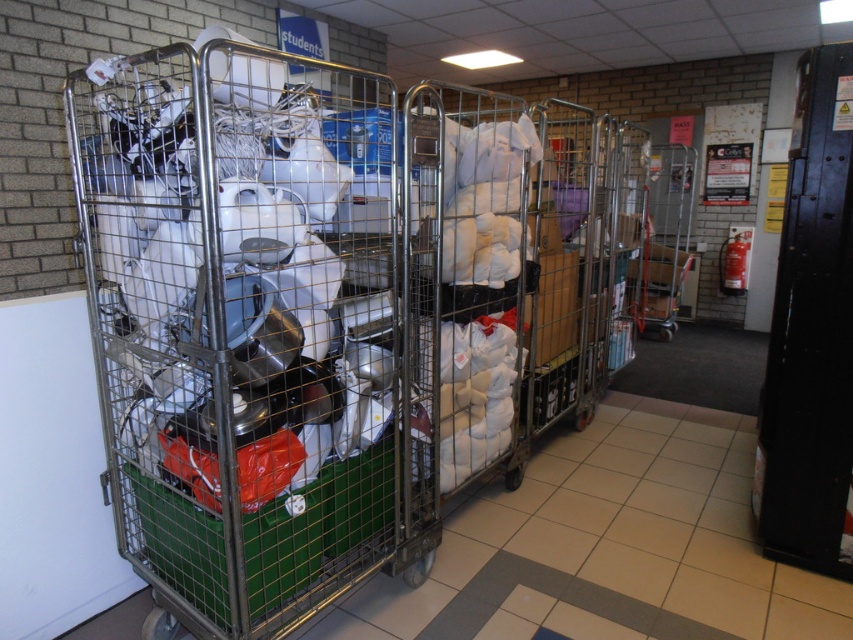
Which is behind, point (218, 260) or point (682, 205)?

The point (682, 205) is behind.

Does metallic silver trolley at left have a lesser height compared to metallic silver trolley at center?

No, metallic silver trolley at left is not shorter than metallic silver trolley at center.

Locate an element on the screen. metallic silver trolley at left is located at coordinates (242, 324).

This screenshot has width=853, height=640. In order to click on metallic silver trolley at left in this screenshot , I will do `click(242, 324)`.